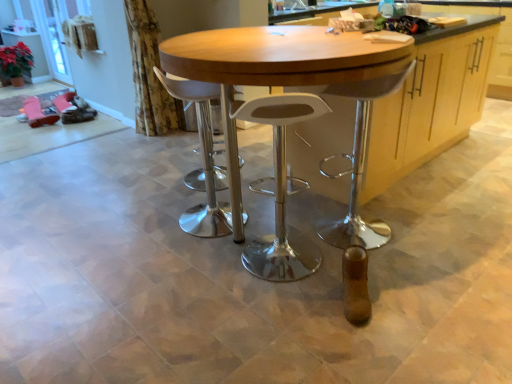
Question: Considering the positions of point (198, 130) and point (61, 49), is point (198, 130) closer or farther from the camera than point (61, 49)?

Choices:
 (A) farther
 (B) closer

Answer: (B)

Question: In the image, is white plastic stool at center, marked as the 1th stool in a left-to-right arrangement, positioned in front of or behind clear glass screen door at upper left?

Choices:
 (A) front
 (B) behind

Answer: (A)

Question: Considering the real-world distances, which object is farthest from the white plastic stool at center, marked as the 1th stool in a left-to-right arrangement?

Choices:
 (A) clear glass screen door at upper left
 (B) wooden cabinet at center
 (C) white plastic stool at center, the second stool from the left
 (D) wooden table at center
 (E) floral fabric curtain at upper left

Answer: (A)

Question: Which of these objects is positioned closest to the white plastic stool at center, arranged as the second stool when viewed from the right?

Choices:
 (A) clear glass screen door at upper left
 (B) white plastic stool at center, the 1th stool from the right
 (C) floral fabric curtain at upper left
 (D) wooden table at center
 (E) wooden cabinet at center

Answer: (B)